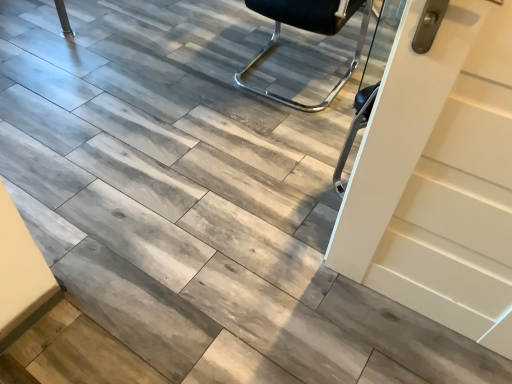
Where is `vacant area in front of black leather chair at center`? vacant area in front of black leather chair at center is located at coordinates (x=263, y=140).